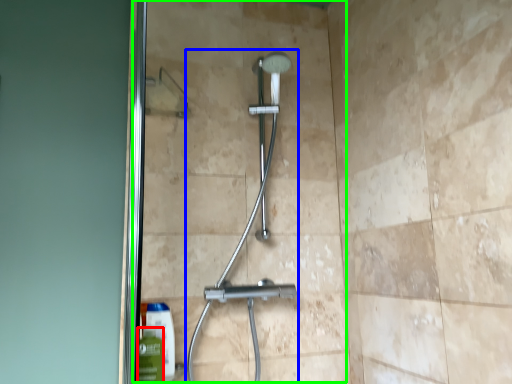
Question: Based on their relative distances, which object is nearer to mouthwash (highlighted by a red box)? Choose from shower (highlighted by a blue box) and glass door (highlighted by a green box).

Choices:
 (A) shower
 (B) glass door

Answer: (A)